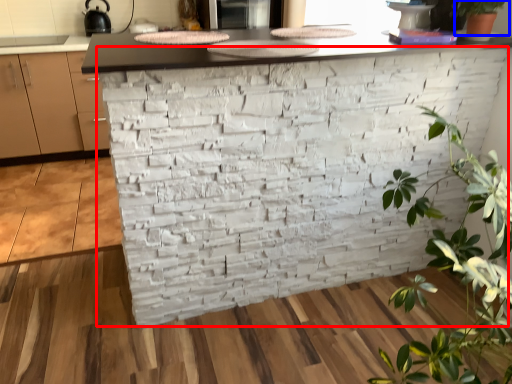
Question: Which of the following is the closest to the observer, brickwork (highlighted by a red box) or houseplant (highlighted by a blue box)?

Choices:
 (A) brickwork
 (B) houseplant

Answer: (A)